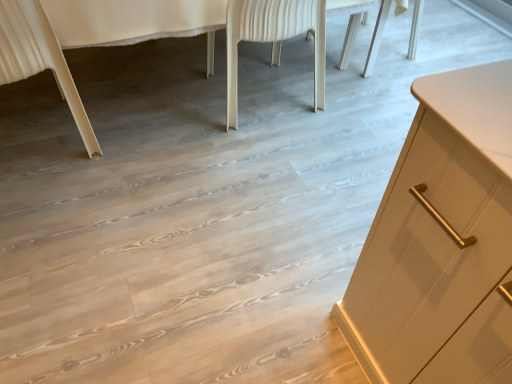
Identify the location of vacant area to the right of light beige wood chair leg at lower left, which is counted as the 2th chair, starting from the right. (131, 137).